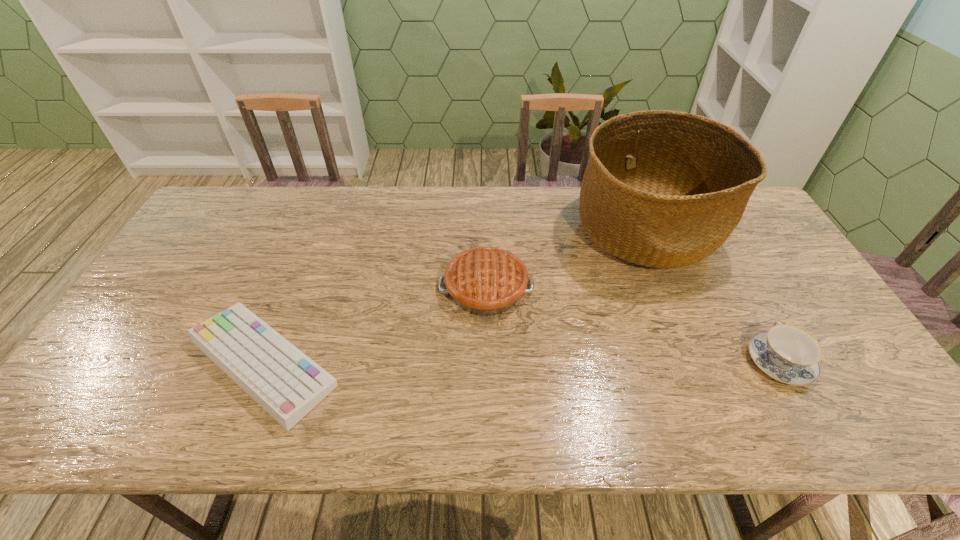
At what (x,y) coordinates should I click in order to perform the action: click on free space located with the handle on the side of the chinaware. Please return your answer as a coordinate pair (x, y). This screenshot has width=960, height=540. Looking at the image, I should click on (715, 246).

The width and height of the screenshot is (960, 540). I want to click on free space located 0.060m on the left of the leftmost object, so click(x=156, y=363).

Image resolution: width=960 pixels, height=540 pixels. I want to click on object at the far edge, so click(665, 189).

At what (x,y) coordinates should I click in order to perform the action: click on object at the near edge. Please return your answer as a coordinate pair (x, y). This screenshot has width=960, height=540. Looking at the image, I should click on (286, 383).

Where is `object situated at the right edge`? The height and width of the screenshot is (540, 960). object situated at the right edge is located at coordinates (788, 354).

In the image, there is a desktop. Identify the location of blank space at the far edge. The image size is (960, 540). (304, 220).

Where is `vacant area at the near edge of the desktop`? vacant area at the near edge of the desktop is located at coordinates (581, 427).

You are a GUI agent. You are given a task and a screenshot of the screen. Output one action in this format:
    pyautogui.click(x=<x>, y=<y>)
    Task: Click on the free region at the left edge of the desktop
    
    Given the screenshot: What is the action you would take?
    pyautogui.click(x=215, y=279)

The height and width of the screenshot is (540, 960). Identify the location of vacant space at the right edge of the desktop. (853, 370).

You are a GUI agent. You are given a task and a screenshot of the screen. Output one action in this format:
    pyautogui.click(x=<x>, y=<y>)
    Task: Click on the empty space that is in between the second shortest object and the computer keyboard
    The image size is (960, 540).
    Given the screenshot: What is the action you would take?
    pyautogui.click(x=521, y=362)